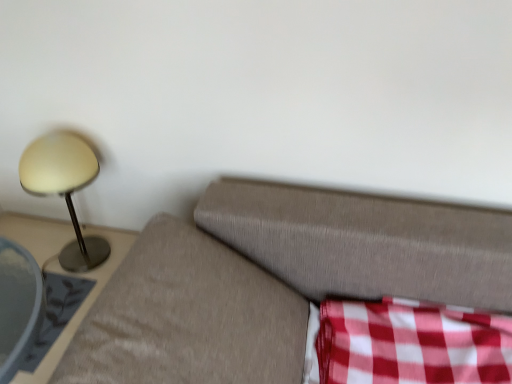
Question: From the image's perspective, is matte gold lamp at left located above metallic gray side table at left?

Choices:
 (A) yes
 (B) no

Answer: (A)

Question: Does matte gold lamp at left have a smaller size compared to metallic gray side table at left?

Choices:
 (A) yes
 (B) no

Answer: (A)

Question: Is matte gold lamp at left oriented away from metallic gray side table at left?

Choices:
 (A) no
 (B) yes

Answer: (A)

Question: Is metallic gray side table at left surrounded by matte gold lamp at left?

Choices:
 (A) yes
 (B) no

Answer: (B)

Question: Is matte gold lamp at left located outside metallic gray side table at left?

Choices:
 (A) no
 (B) yes

Answer: (B)

Question: Considering the relative positions of red checkered fabric at lower right and metallic gray side table at left in the image provided, is red checkered fabric at lower right to the left or to the right of metallic gray side table at left?

Choices:
 (A) left
 (B) right

Answer: (B)

Question: From the image's perspective, is red checkered fabric at lower right above or below metallic gray side table at left?

Choices:
 (A) above
 (B) below

Answer: (A)

Question: In terms of width, does red checkered fabric at lower right look wider or thinner when compared to metallic gray side table at left?

Choices:
 (A) thin
 (B) wide

Answer: (A)

Question: Considering the positions of red checkered fabric at lower right and metallic gray side table at left in the image, is red checkered fabric at lower right taller or shorter than metallic gray side table at left?

Choices:
 (A) tall
 (B) short

Answer: (B)

Question: Considering the positions of matte gold lamp at left and red checkered fabric at lower right in the image, is matte gold lamp at left wider or thinner than red checkered fabric at lower right?

Choices:
 (A) thin
 (B) wide

Answer: (A)

Question: From a real-world perspective, relative to red checkered fabric at lower right, is matte gold lamp at left vertically above or below?

Choices:
 (A) below
 (B) above

Answer: (B)

Question: Is matte gold lamp at left in front of or behind red checkered fabric at lower right in the image?

Choices:
 (A) front
 (B) behind

Answer: (B)

Question: Considering the positions of point (52, 168) and point (390, 299), is point (52, 168) closer or farther from the camera than point (390, 299)?

Choices:
 (A) farther
 (B) closer

Answer: (A)

Question: From the image's perspective, is matte gold lamp at left positioned above or below metallic gray side table at left?

Choices:
 (A) below
 (B) above

Answer: (B)

Question: Choose the correct answer: Is matte gold lamp at left inside metallic gray side table at left or outside it?

Choices:
 (A) outside
 (B) inside

Answer: (A)